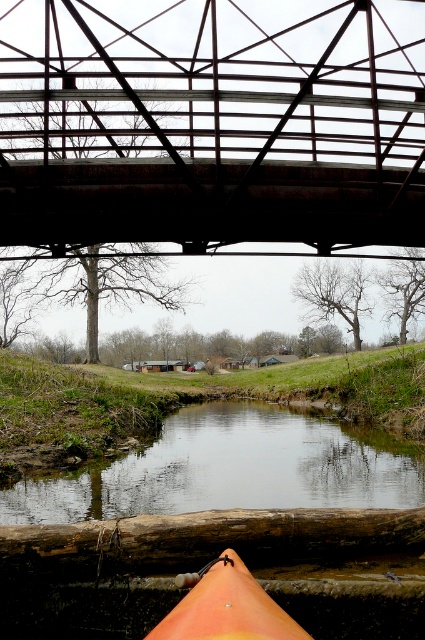
Question: Which object is farther from the camera taking this photo?

Choices:
 (A) rusty metal bridge at upper center
 (B) orange matte canoe at lower center

Answer: (A)

Question: Is brown rough wood log at lower center further to camera compared to orange matte canoe at lower center?

Choices:
 (A) yes
 (B) no

Answer: (A)

Question: Among these objects, which one is nearest to the camera?

Choices:
 (A) brown rough wood log at lower center
 (B) smooth brown water at center
 (C) orange matte canoe at lower center

Answer: (C)

Question: Does rusty metal bridge at upper center have a lesser width compared to brown rough wood log at lower center?

Choices:
 (A) no
 (B) yes

Answer: (A)

Question: Which point is closer to the camera taking this photo?

Choices:
 (A) (200, 600)
 (B) (5, 241)
 (C) (135, 500)
 (D) (124, 516)

Answer: (A)

Question: Does smooth brown water at center have a greater width compared to brown rough wood log at lower center?

Choices:
 (A) yes
 (B) no

Answer: (A)